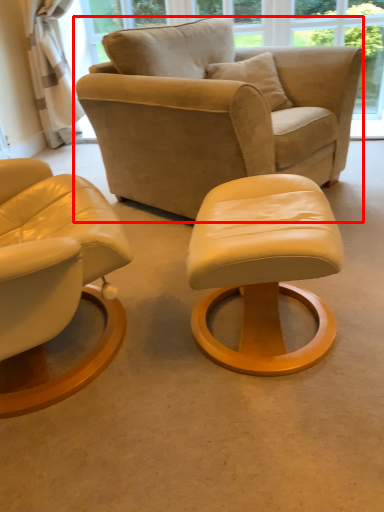
Question: From the image's perspective, what is the correct spatial positioning of chair (annotated by the red box) in reference to stool?

Choices:
 (A) above
 (B) below

Answer: (A)